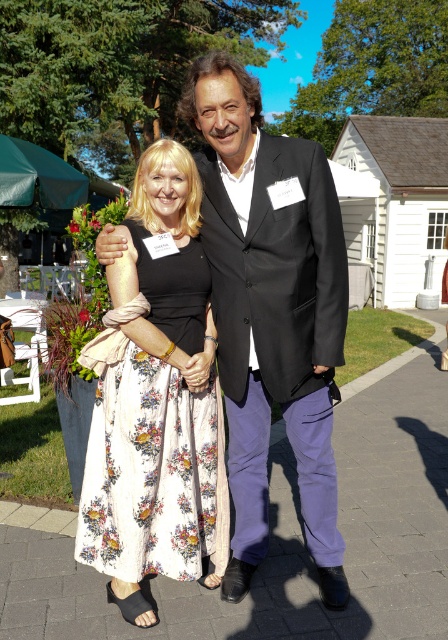
From the picture: Is white concrete pavement at center closer to camera compared to floral cotton dress at center?

No.

Does white concrete pavement at center appear over floral cotton dress at center?

No.

The width and height of the screenshot is (448, 640). What do you see at coordinates (283, 536) in the screenshot? I see `white concrete pavement at center` at bounding box center [283, 536].

Image resolution: width=448 pixels, height=640 pixels. Find the location of `white concrete pavement at center`. white concrete pavement at center is located at coordinates (283, 536).

Can you confirm if black satin suit at center is positioned above floral cotton dress at center?

Correct, black satin suit at center is located above floral cotton dress at center.

Between point (323, 326) and point (211, 435), which one is positioned behind?

The point (211, 435) is more distant.

Where is `black satin suit at center`? The height and width of the screenshot is (640, 448). black satin suit at center is located at coordinates (271, 310).

Is white concrete pavement at center positioned before black satin suit at center?

No, it is not.

Does point (383, 371) lie in front of point (202, 131)?

No, it is behind (202, 131).

Find the location of a particular element. This screenshot has height=640, width=448. white concrete pavement at center is located at coordinates (283, 536).